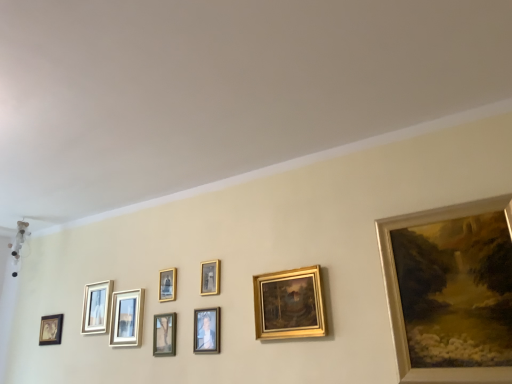
This screenshot has height=384, width=512. What do you see at coordinates (450, 292) in the screenshot?
I see `gold metallic painting at upper right, which is the 9th picture frame from left to right` at bounding box center [450, 292].

The height and width of the screenshot is (384, 512). What do you see at coordinates (164, 335) in the screenshot?
I see `green matte picture frame at center, the fifth picture frame when ordered from left to right` at bounding box center [164, 335].

What are the coordinates of `matte gold picture frame at upper left, which appears as the eighth picture frame when viewed from the right` in the screenshot? It's located at (96, 307).

In order to face gold/gilded painting at center, which appears as the 8th picture frame when viewed from the left, should I rotate leftwards or rightwards?

Rotate right and turn 4.288 degrees.

Locate an element on the screen. gold metallic picture frame at center, which appears as the fourth picture frame when viewed from the left is located at coordinates (167, 285).

You are a GUI agent. You are given a task and a screenshot of the screen. Output one action in this format:
    pyautogui.click(x=<x>, y=<y>)
    Task: Click on the gold metallic photo frame at center, the 3th picture frame from the right
    Image resolution: width=512 pixels, height=384 pixels.
    Given the screenshot: What is the action you would take?
    pyautogui.click(x=210, y=277)

Looking at the image, does green matte picture frame at center, marked as the 5th picture frame in a right-to-left arrangement, seem bigger or smaller compared to matte white picture frame at center, which is the seventh picture frame from right to left?

Clearly, green matte picture frame at center, marked as the 5th picture frame in a right-to-left arrangement, is smaller in size than matte white picture frame at center, which is the seventh picture frame from right to left.

From a real-world perspective, is green matte picture frame at center, the fifth picture frame when ordered from left to right, under matte white picture frame at center, which is the seventh picture frame from right to left?

Yes, from a real-world perspective, green matte picture frame at center, the fifth picture frame when ordered from left to right, is below matte white picture frame at center, which is the seventh picture frame from right to left.

Who is shorter, green matte picture frame at center, marked as the 5th picture frame in a right-to-left arrangement, or matte white picture frame at center, which is the seventh picture frame from right to left?

green matte picture frame at center, marked as the 5th picture frame in a right-to-left arrangement.

Is green matte picture frame at center, the fifth picture frame when ordered from left to right, facing towards matte white picture frame at center, which appears as the third picture frame when viewed from the left?

No.

From a real-world perspective, is matte gold picture frame at center, the 6th picture frame viewed from the left, over gold metallic painting at upper right, positioned as the 1th picture frame in right-to-left order?

No, from a real-world perspective, matte gold picture frame at center, the 6th picture frame viewed from the left, is not over gold metallic painting at upper right, positioned as the 1th picture frame in right-to-left order

Starting from the matte gold picture frame at center, which is the 4th picture frame from right to left, which picture frame is the 3rd one to the right? Please provide its 2D coordinates.

[(450, 292)]

Does point (199, 330) come farther from viewer compared to point (502, 352)?

Yes, it is behind point (502, 352).

Between matte gold picture frame at center, which is the 4th picture frame from right to left, and gold metallic painting at upper right, which is the 9th picture frame from left to right, which one has smaller width?

matte gold picture frame at center, which is the 4th picture frame from right to left.

Considering the sizes of matte white picture frame at center, which appears as the third picture frame when viewed from the left, and gold metallic painting at upper right, which is the 9th picture frame from left to right, in the image, is matte white picture frame at center, which appears as the third picture frame when viewed from the left, wider or thinner than gold metallic painting at upper right, which is the 9th picture frame from left to right,?

Considering their sizes, matte white picture frame at center, which appears as the third picture frame when viewed from the left, looks slimmer than gold metallic painting at upper right, which is the 9th picture frame from left to right.

Considering the relative sizes of matte white picture frame at center, which appears as the third picture frame when viewed from the left, and gold metallic painting at upper right, positioned as the 1th picture frame in right-to-left order, in the image provided, is matte white picture frame at center, which appears as the third picture frame when viewed from the left, shorter than gold metallic painting at upper right, positioned as the 1th picture frame in right-to-left order,?

Correct, matte white picture frame at center, which appears as the third picture frame when viewed from the left, is not as tall as gold metallic painting at upper right, positioned as the 1th picture frame in right-to-left order.

From a real-world perspective, is matte white picture frame at center, which appears as the third picture frame when viewed from the left, located higher than gold metallic painting at upper right, which is the 9th picture frame from left to right?

Yes, from a real-world perspective, matte white picture frame at center, which appears as the third picture frame when viewed from the left, is on top of gold metallic painting at upper right, which is the 9th picture frame from left to right.

Is matte white picture frame at center, which appears as the third picture frame when viewed from the left, located outside gold metallic painting at upper right, which is the 9th picture frame from left to right?

matte white picture frame at center, which appears as the third picture frame when viewed from the left, lies outside gold metallic painting at upper right, which is the 9th picture frame from left to right,'s area.

From the image's perspective, which one is positioned lower, matte gold picture frame at center, which is the 4th picture frame from right to left, or green matte picture frame at center, marked as the 5th picture frame in a right-to-left arrangement?

From the image's view, green matte picture frame at center, marked as the 5th picture frame in a right-to-left arrangement, is below.

Is matte gold picture frame at center, the 6th picture frame viewed from the left, looking in the opposite direction of green matte picture frame at center, the fifth picture frame when ordered from left to right?

No, matte gold picture frame at center, the 6th picture frame viewed from the left, is not facing the opposite direction of green matte picture frame at center, the fifth picture frame when ordered from left to right.

In terms of size, does matte gold picture frame at center, which is the 4th picture frame from right to left, appear bigger or smaller than green matte picture frame at center, marked as the 5th picture frame in a right-to-left arrangement?

Clearly, matte gold picture frame at center, which is the 4th picture frame from right to left, is larger in size than green matte picture frame at center, marked as the 5th picture frame in a right-to-left arrangement.

Which picture frame is the 2nd one when counting from the front of the green matte picture frame at center, the fifth picture frame when ordered from left to right? Please provide its 2D coordinates.

[(207, 330)]

Considering the relative sizes of gold metallic photo frame at center, the 3th picture frame from the right, and matte gold picture frame at center, which is the 4th picture frame from right to left, in the image provided, is gold metallic photo frame at center, the 3th picture frame from the right, smaller than matte gold picture frame at center, which is the 4th picture frame from right to left,?

Yes, gold metallic photo frame at center, the 3th picture frame from the right, is smaller than matte gold picture frame at center, which is the 4th picture frame from right to left.

Measure the distance between gold metallic photo frame at center, placed as the seventh picture frame when sorted from left to right, and matte gold picture frame at center, which is the 4th picture frame from right to left.

gold metallic photo frame at center, placed as the seventh picture frame when sorted from left to right, and matte gold picture frame at center, which is the 4th picture frame from right to left, are 6.63 inches apart from each other.

Is gold metallic photo frame at center, the 3th picture frame from the right, completely or partially outside of matte gold picture frame at center, which is the 4th picture frame from right to left?

Yes, gold metallic photo frame at center, the 3th picture frame from the right, is outside of matte gold picture frame at center, which is the 4th picture frame from right to left.

From a real-world perspective, which is physically above, gold metallic photo frame at center, placed as the seventh picture frame when sorted from left to right, or matte gold picture frame at center, the 6th picture frame viewed from the left?

gold metallic photo frame at center, placed as the seventh picture frame when sorted from left to right, is physically above.

Between matte black picture frame at lower left, which appears as the first picture frame when viewed from the left, and gold metallic painting at upper right, which is the 9th picture frame from left to right, which one has less height?

matte black picture frame at lower left, which appears as the first picture frame when viewed from the left, is shorter.

Which point is more distant from viewer, (48,341) or (453,215)?

The point (48,341) is more distant.

Between matte black picture frame at lower left, marked as the 9th picture frame in a right-to-left arrangement, and gold metallic painting at upper right, which is the 9th picture frame from left to right, which one has larger width?

gold metallic painting at upper right, which is the 9th picture frame from left to right, is wider.

Is matte black picture frame at lower left, marked as the 9th picture frame in a right-to-left arrangement, located outside gold metallic painting at upper right, which is the 9th picture frame from left to right?

matte black picture frame at lower left, marked as the 9th picture frame in a right-to-left arrangement, lies outside gold metallic painting at upper right, which is the 9th picture frame from left to right,'s area.

From the image's perspective, would you say gold metallic painting at upper right, positioned as the 1th picture frame in right-to-left order, is shown under green matte picture frame at center, the fifth picture frame when ordered from left to right?

Incorrect, from the image's perspective, gold metallic painting at upper right, positioned as the 1th picture frame in right-to-left order, is higher than green matte picture frame at center, the fifth picture frame when ordered from left to right.

Is gold metallic painting at upper right, positioned as the 1th picture frame in right-to-left order, facing towards green matte picture frame at center, the fifth picture frame when ordered from left to right?

No, gold metallic painting at upper right, positioned as the 1th picture frame in right-to-left order, is not facing towards green matte picture frame at center, the fifth picture frame when ordered from left to right.

Looking at the image, does gold metallic painting at upper right, which is the 9th picture frame from left to right, seem bigger or smaller compared to green matte picture frame at center, the fifth picture frame when ordered from left to right?

In the image, gold metallic painting at upper right, which is the 9th picture frame from left to right, appears to be larger than green matte picture frame at center, the fifth picture frame when ordered from left to right.

Is green matte picture frame at center, marked as the 5th picture frame in a right-to-left arrangement, a part of gold metallic painting at upper right, which is the 9th picture frame from left to right?

No, gold metallic painting at upper right, which is the 9th picture frame from left to right, does not contain green matte picture frame at center, marked as the 5th picture frame in a right-to-left arrangement.

From a real-world perspective, which picture frame is the 5th one underneath the matte white picture frame at center, which appears as the third picture frame when viewed from the left? Please provide its 2D coordinates.

[(164, 335)]

You are a GUI agent. You are given a task and a screenshot of the screen. Output one action in this format:
    pyautogui.click(x=<x>, y=<y>)
    Task: Click on the 2nd picture frame behind the gold metallic painting at upper right, positioned as the 1th picture frame in right-to-left order
    
    Given the screenshot: What is the action you would take?
    pyautogui.click(x=207, y=330)

From the image, which object appears to be farther from matte gold picture frame at upper left, which appears as the eighth picture frame when viewed from the right, matte black picture frame at lower left, which appears as the first picture frame when viewed from the left, or gold metallic photo frame at center, placed as the seventh picture frame when sorted from left to right?

Among the two, gold metallic photo frame at center, placed as the seventh picture frame when sorted from left to right, is located further to matte gold picture frame at upper left, which appears as the eighth picture frame when viewed from the right.

In the scene shown: Based on their spatial positions, is green matte picture frame at center, the fifth picture frame when ordered from left to right, or gold/gilded painting at center, which appears as the 8th picture frame when viewed from the left, further from gold metallic painting at upper right, positioned as the 1th picture frame in right-to-left order?

Among the two, green matte picture frame at center, the fifth picture frame when ordered from left to right, is located further to gold metallic painting at upper right, positioned as the 1th picture frame in right-to-left order.

Estimate the real-world distances between objects in this image. Which object is closer to green matte picture frame at center, marked as the 5th picture frame in a right-to-left arrangement, gold metallic painting at upper right, which is the 9th picture frame from left to right, or matte white picture frame at center, which is the seventh picture frame from right to left?

matte white picture frame at center, which is the seventh picture frame from right to left, is closer to green matte picture frame at center, marked as the 5th picture frame in a right-to-left arrangement.

Based on their spatial positions, is matte gold picture frame at center, the 6th picture frame viewed from the left, or matte gold picture frame at upper left, acting as the second picture frame starting from the left, further from gold metallic painting at upper right, which is the 9th picture frame from left to right?

matte gold picture frame at upper left, acting as the second picture frame starting from the left.

From the image, which object appears to be nearer to gold metallic painting at upper right, which is the 9th picture frame from left to right, matte white picture frame at center, which is the seventh picture frame from right to left, or gold/gilded painting at center, which appears as the 8th picture frame when viewed from the left?

gold/gilded painting at center, which appears as the 8th picture frame when viewed from the left, is closer to gold metallic painting at upper right, which is the 9th picture frame from left to right.

From the image, which object appears to be farther from matte black picture frame at lower left, marked as the 9th picture frame in a right-to-left arrangement, gold metallic painting at upper right, which is the 9th picture frame from left to right, or matte gold picture frame at center, the 6th picture frame viewed from the left?

Based on the image, gold metallic painting at upper right, which is the 9th picture frame from left to right, appears to be further to matte black picture frame at lower left, marked as the 9th picture frame in a right-to-left arrangement.

Based on their spatial positions, is matte white picture frame at center, which is the seventh picture frame from right to left, or matte black picture frame at lower left, which appears as the first picture frame when viewed from the left, closer to gold metallic photo frame at center, the 3th picture frame from the right?

matte white picture frame at center, which is the seventh picture frame from right to left, is closer to gold metallic photo frame at center, the 3th picture frame from the right.

Looking at the image, which one is located further to gold/gilded painting at center, which appears as the 8th picture frame when viewed from the left, gold metallic picture frame at center, positioned as the sixth picture frame in right-to-left order, or gold metallic painting at upper right, positioned as the 1th picture frame in right-to-left order?

gold metallic picture frame at center, positioned as the sixth picture frame in right-to-left order.

Where is `picture frame located between matte black picture frame at lower left, which appears as the first picture frame when viewed from the left, and matte white picture frame at center, which is the seventh picture frame from right to left, in the left-right direction`? The width and height of the screenshot is (512, 384). picture frame located between matte black picture frame at lower left, which appears as the first picture frame when viewed from the left, and matte white picture frame at center, which is the seventh picture frame from right to left, in the left-right direction is located at coordinates [x=96, y=307].

Identify the location of picture frame situated between gold metallic picture frame at center, positioned as the sixth picture frame in right-to-left order, and matte gold picture frame at center, the 6th picture frame viewed from the left, from left to right. The height and width of the screenshot is (384, 512). (164, 335).

Locate an element on the screen. picture frame situated between matte white picture frame at center, which is the seventh picture frame from right to left, and green matte picture frame at center, the fifth picture frame when ordered from left to right, from left to right is located at coordinates (x=167, y=285).

Where is `picture frame between matte gold picture frame at center, the 6th picture frame viewed from the left, and gold/gilded painting at center, the 2th picture frame from the right, in the horizontal direction`? The width and height of the screenshot is (512, 384). picture frame between matte gold picture frame at center, the 6th picture frame viewed from the left, and gold/gilded painting at center, the 2th picture frame from the right, in the horizontal direction is located at coordinates (210, 277).